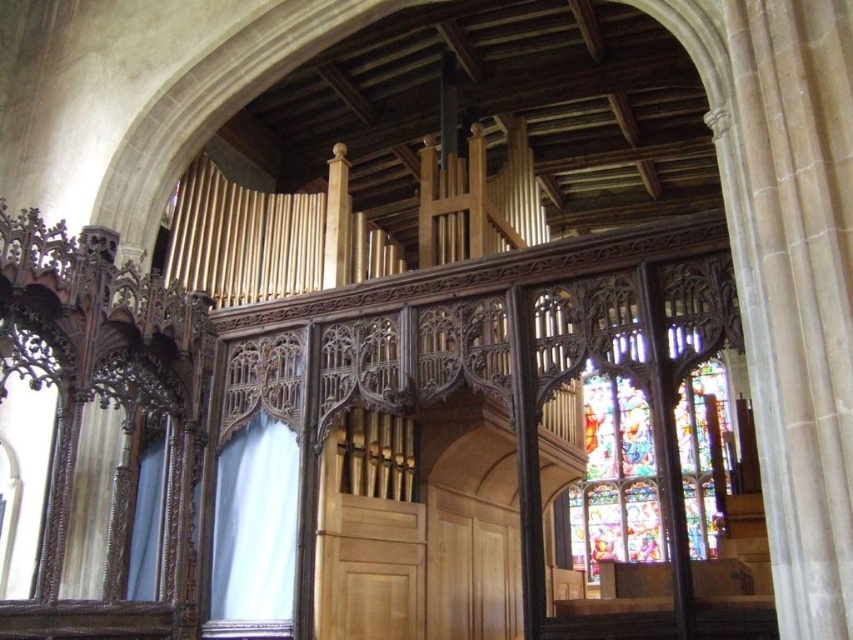
Question: Is stained glass at center below transparent glass at center?

Choices:
 (A) yes
 (B) no

Answer: (A)

Question: Is stained glass at center in front of transparent glass at center?

Choices:
 (A) no
 (B) yes

Answer: (B)

Question: Does stained glass at center have a greater width compared to transparent glass at center?

Choices:
 (A) no
 (B) yes

Answer: (B)

Question: Among these objects, which one is farthest from the camera?

Choices:
 (A) transparent glass at center
 (B) stained glass at center

Answer: (A)